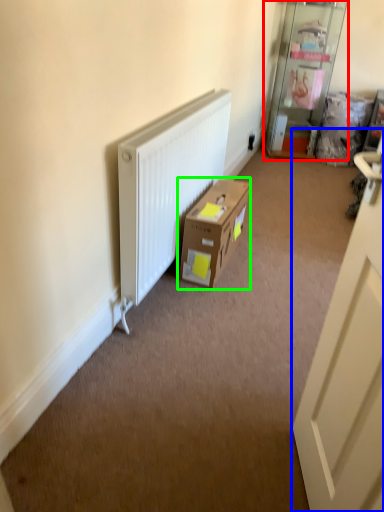
Question: Estimate the real-world distances between objects in this image. Which object is closer to shelf (highlighted by a red box), door (highlighted by a blue box) or box (highlighted by a green box)?

Choices:
 (A) door
 (B) box

Answer: (B)